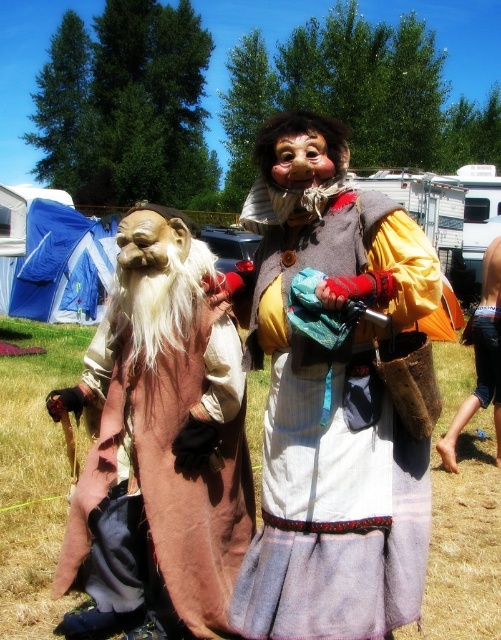
You are standing at the campsite and want to take a photo of both point markers. Which point marker, point (x=300, y=621) or point (x=300, y=170), will appear larger in the photo?

Point (x=300, y=621) will appear larger in the photo because it is closer to the camera than point (x=300, y=170).

You are a photographer at the festival and need to capture both the worn fabric dress at center and the brown suede cloak at left in a single shot. Which object should you focus on first to ensure both are in frame?

You should focus on the brown suede cloak at left first because the worn fabric dress at center is in front of it, so adjusting the camera to include the background object will naturally include the foreground one.